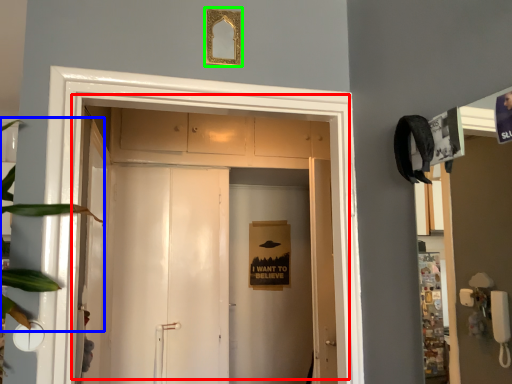
Question: Estimate the real-world distances between objects in this image. Which object is closer to door (highlighted by a red box), plant (highlighted by a blue box) or picture frame (highlighted by a green box)?

Choices:
 (A) plant
 (B) picture frame

Answer: (B)